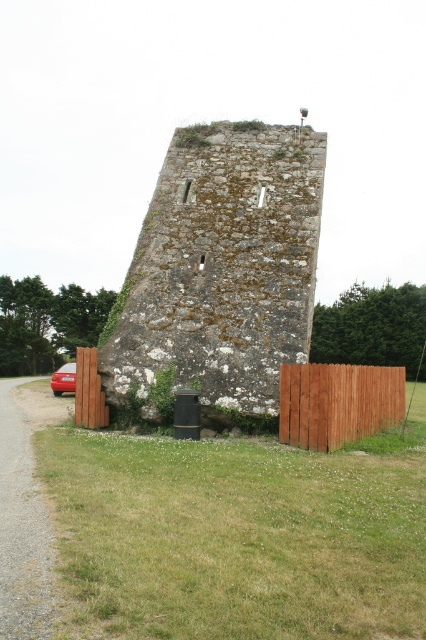
You are a delivery person with a cart that is 50 feet long. You need to deliver a package to the weathered stone tower. The brown wooden fence at lower right is in your way. Can you go around it?

The brown wooden fence at lower right is 46.71 feet from camera. Since your cart is 50 feet long, which is longer than the distance to the fence, you cannot maneuver around it without hitting the fence. You need to find an alternative path or reduce the cart length.

You are a delivery driver approaching the brown wooden fence at lower left and the shiny red sedan at left. Which object is closer to the entrance of the weathered stone tower?

The brown wooden fence at lower left is closer to the entrance of the weathered stone tower because it is smaller than the shiny red sedan at left, indicating proximity.